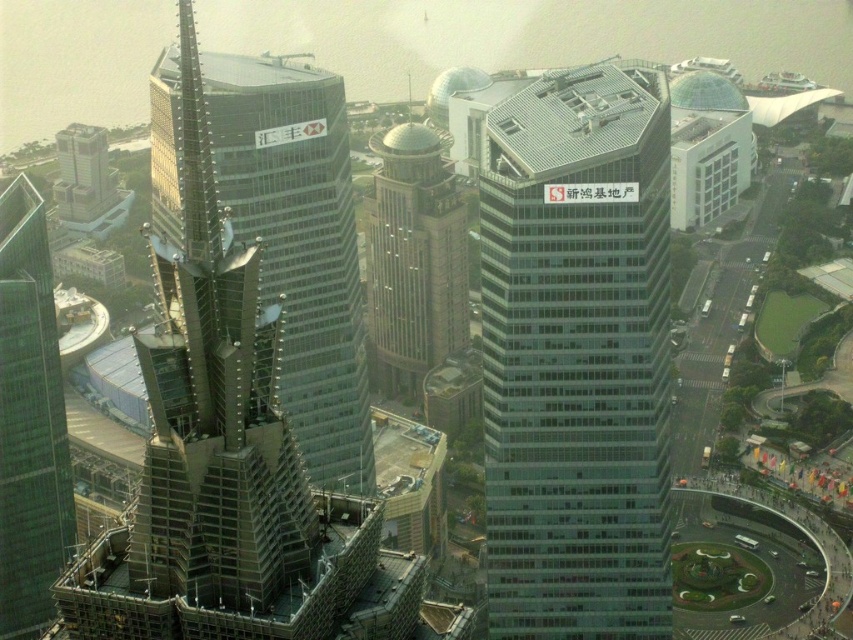
Is point (608, 92) positioned behind point (740, 147)?

No, it is in front of (740, 147).

Between point (610, 147) and point (699, 166), which one is positioned behind?

Positioned behind is point (699, 166).

Measure the distance between point (631, 454) and camera.

They are 528.20 meters apart.

Image resolution: width=853 pixels, height=640 pixels. I want to click on transparent glass building at center, so click(x=576, y=355).

Between transparent glass building at center and glassy steel skyscraper at left, which one appears on the left side from the viewer's perspective?

glassy steel skyscraper at left

Can you confirm if transparent glass building at center is positioned to the left of glassy steel skyscraper at left?

In fact, transparent glass building at center is to the right of glassy steel skyscraper at left.

Describe the element at coordinates (576, 355) in the screenshot. I see `transparent glass building at center` at that location.

I want to click on transparent glass building at center, so click(576, 355).

Which is more to the right, transparent glass building at center or transparent glass skyscraper at center?

transparent glass building at center is more to the right.

Is point (515, 186) farther from viewer compared to point (339, 140)?

No, it is not.

Which is in front, point (526, 419) or point (334, 148)?

Positioned in front is point (526, 419).

In order to click on transparent glass building at center in this screenshot , I will do `click(576, 355)`.